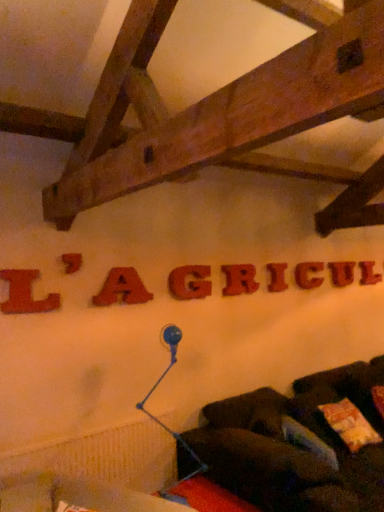
This screenshot has height=512, width=384. What do you see at coordinates (190, 282) in the screenshot?
I see `red matte letter g at center, placed as the 4th letter when sorted from left to right` at bounding box center [190, 282].

You are a GUI agent. You are given a task and a screenshot of the screen. Output one action in this format:
    pyautogui.click(x=<x>, y=<y>)
    Task: Click on the matte red letter at center, acting as the 4th letter starting from the back
    The width and height of the screenshot is (384, 512).
    Given the screenshot: What is the action you would take?
    pyautogui.click(x=277, y=277)

Where is `matte red letter at left, which is the 1th letter from left to right`? Image resolution: width=384 pixels, height=512 pixels. matte red letter at left, which is the 1th letter from left to right is located at coordinates (25, 293).

Where is `dark brown fabric couch at lower right`? This screenshot has height=512, width=384. dark brown fabric couch at lower right is located at coordinates (296, 445).

The height and width of the screenshot is (512, 384). Identify the location of blue glass lamp at lower center. (157, 386).

Describe the element at coordinates (157, 386) in the screenshot. The width and height of the screenshot is (384, 512). I see `blue glass lamp at lower center` at that location.

Describe the element at coordinates (341, 273) in the screenshot. I see `matte red letter at upper center, arranged as the 2th letter when viewed from the back` at that location.

At what (x,y) coordinates should I click in order to perform the action: click on matte red letter at upper center, which is the eighth letter in left-to-right order. Please return your answer as a coordinate pair (x, y). This screenshot has width=384, height=512. Looking at the image, I should click on (341, 273).

Identify the location of red matte letter g at center, the sixth letter viewed from the right. This screenshot has width=384, height=512. (190, 282).

From a real-world perspective, is rubberized red letter r at center, placed as the 5th letter when sorted from left to right, positioned under matte red letter at center, which is the third letter from right to left, based on gravity?

No.

Is rubberized red letter r at center, placed as the fifth letter when sorted from front to back, positioned far away from matte red letter at center, which appears as the 7th letter when viewed from the left?

No, rubberized red letter r at center, placed as the fifth letter when sorted from front to back, is not far away from matte red letter at center, which appears as the 7th letter when viewed from the left.

From the picture: Is rubberized red letter r at center, arranged as the 5th letter when viewed from the right, completely or partially outside of matte red letter at center, which is the 7th letter in front-to-back order?

Yes, rubberized red letter r at center, arranged as the 5th letter when viewed from the right, is outside of matte red letter at center, which is the 7th letter in front-to-back order.

How many degrees apart are the facing directions of rubberized red letter r at center, placed as the 5th letter when sorted from left to right, and matte red letter at center, which is the third letter from right to left?

0.575 degrees separate the facing orientations of rubberized red letter r at center, placed as the 5th letter when sorted from left to right, and matte red letter at center, which is the third letter from right to left.

From a real-world perspective, count 8th letters upward from the matte red letter at center, the 6th letter in the front-to-back sequence, and point to it. Please provide its 2D coordinates.

[(71, 262)]

Is point (273, 287) farther from viewer compared to point (72, 261)?

Yes.

From a real-world perspective, is matte red letter at center, arranged as the 4th letter when viewed from the right, physically below matte red letter at upper center, the 8th letter viewed from the right?

Yes, from a real-world perspective, matte red letter at center, arranged as the 4th letter when viewed from the right, is below matte red letter at upper center, the 8th letter viewed from the right.

From the picture: Is red matte letter g at center, the sixth letter viewed from the right, aimed at matte red letter a at center, which appears as the 7th letter when viewed from the back?

No, red matte letter g at center, the sixth letter viewed from the right, is not aimed at matte red letter a at center, which appears as the 7th letter when viewed from the back.

Which is correct: red matte letter g at center, which ranks as the 4th letter in front-to-back order, is inside matte red letter a at center, which is the 7th letter from right to left, or outside of it?

red matte letter g at center, which ranks as the 4th letter in front-to-back order, is not enclosed by matte red letter a at center, which is the 7th letter from right to left.

Are red matte letter g at center, the sixth letter viewed from the right, and matte red letter a at center, which appears as the 7th letter when viewed from the back, located far from each other?

They are positioned close to each other.

Considering the relative positions of red matte letter g at center, placed as the 4th letter when sorted from left to right, and matte red letter a at center, which appears as the 7th letter when viewed from the back, in the image provided, is red matte letter g at center, placed as the 4th letter when sorted from left to right, behind matte red letter a at center, which appears as the 7th letter when viewed from the back,?

That is True.

From the picture: Which object is thinner, matte red letter at upper center, arranged as the second letter when viewed from the front, or matte red letter at center, acting as the third letter starting from the back?

Thinner between the two is matte red letter at upper center, arranged as the second letter when viewed from the front.

Would you say matte red letter at center, which is the 7th letter in front-to-back order, is part of matte red letter at upper center, the 8th letter viewed from the right,'s contents?

No, matte red letter at center, which is the 7th letter in front-to-back order, is not a part of matte red letter at upper center, the 8th letter viewed from the right.

From a real-world perspective, is matte red letter at upper center, which is counted as the 2th letter, starting from the left, physically above matte red letter at center, acting as the third letter starting from the back?

Indeed, from a real-world perspective, matte red letter at upper center, which is counted as the 2th letter, starting from the left, stands above matte red letter at center, acting as the third letter starting from the back.

In terms of height, does dark brown fabric couch at lower right look taller or shorter compared to red matte letter g at center, which ranks as the 4th letter in front-to-back order?

Clearly, dark brown fabric couch at lower right is taller compared to red matte letter g at center, which ranks as the 4th letter in front-to-back order.

Could you measure the distance between dark brown fabric couch at lower right and red matte letter g at center, which ranks as the 4th letter in front-to-back order?

3.76 feet.

Between point (333, 444) and point (174, 275), which one is positioned behind?

The point (174, 275) is more distant.

Locate an element on the screen. studio couch directly beneath the red matte letter g at center, placed as the 4th letter when sorted from left to right (from a real-world perspective) is located at coordinates (296, 445).

Is point (178, 274) closer or farther from the camera than point (176, 330)?

Clearly, point (178, 274) is more distant from the camera than point (176, 330).

Which object is positioned more to the left, red matte letter g at center, placed as the sixth letter when sorted from back to front, or blue glass lamp at lower center?

blue glass lamp at lower center.

Which of these two, red matte letter g at center, placed as the sixth letter when sorted from back to front, or blue glass lamp at lower center, is wider?

blue glass lamp at lower center is wider.

Image resolution: width=384 pixels, height=512 pixels. Find the location of `lamp that appears below the red matte letter g at center, the sixth letter viewed from the right (from the image's perspective)`. lamp that appears below the red matte letter g at center, the sixth letter viewed from the right (from the image's perspective) is located at coordinates (157, 386).

Which is more to the left, matte red letter at upper center, which is counted as the 2th letter, starting from the right, or red matte letter g at center, the sixth letter viewed from the right?

red matte letter g at center, the sixth letter viewed from the right.

Who is smaller, matte red letter at upper center, which is counted as the 2th letter, starting from the right, or red matte letter g at center, the sixth letter viewed from the right?

matte red letter at upper center, which is counted as the 2th letter, starting from the right, is smaller.

Is matte red letter at upper center, which is the eighth letter in left-to-right order, far away from red matte letter g at center, which ranks as the 4th letter in front-to-back order?

Indeed, matte red letter at upper center, which is the eighth letter in left-to-right order, is not near red matte letter g at center, which ranks as the 4th letter in front-to-back order.

You are a GUI agent. You are given a task and a screenshot of the screen. Output one action in this format:
    pyautogui.click(x=<x>, y=<y>)
    Task: Click on the letter that is the 2nd one when counting backward from the rubberized red letter r at center, placed as the fifth letter when sorted from front to back
    
    Given the screenshot: What is the action you would take?
    coord(309,275)

At what (x,y) coordinates should I click in order to perform the action: click on the 4th letter counting from the right of the matte red letter at upper center, the 8th letter viewed from the right. Please return your answer as a coordinate pair (x, y). This screenshot has width=384, height=512. Looking at the image, I should click on (277, 277).

Estimate the real-world distances between objects in this image. Which object is further from red matte letter g at center, placed as the sixth letter when sorted from back to front, matte red letter at center, acting as the 4th letter starting from the back, or matte red letter at left, which is the 1th letter from left to right?

matte red letter at left, which is the 1th letter from left to right, lies further to red matte letter g at center, placed as the sixth letter when sorted from back to front, than the other object.

From the image, which object appears to be nearer to matte red letter at upper center, which is counted as the 2th letter, starting from the left, blue glass lamp at lower center or rubberized red letter r at center, which ranks as the 5th letter in back-to-front order?

Based on the image, blue glass lamp at lower center appears to be nearer to matte red letter at upper center, which is counted as the 2th letter, starting from the left.

Considering their positions, is matte red sign at center, which appears as the first letter when viewed from the right, positioned further to dark brown fabric couch at lower right than blue glass lamp at lower center?

The object further to dark brown fabric couch at lower right is matte red sign at center, which appears as the first letter when viewed from the right.

Looking at the image, which one is located closer to matte red letter at upper center, acting as the eighth letter starting from the back, matte red sign at center, which appears as the first letter when viewed from the right, or matte red letter at center, which is the third letter from right to left?

matte red letter at center, which is the third letter from right to left, is positioned closer to the anchor matte red letter at upper center, acting as the eighth letter starting from the back.

Based on their spatial positions, is rubberized red letter r at center, placed as the 5th letter when sorted from left to right, or matte red sign at center, which appears as the first letter when viewed from the right, further from dark brown fabric couch at lower right?

Based on the image, matte red sign at center, which appears as the first letter when viewed from the right, appears to be further to dark brown fabric couch at lower right.

Considering their positions, is red matte letter g at center, the sixth letter viewed from the right, positioned closer to matte red letter at upper center, arranged as the second letter when viewed from the front, than matte red sign at center, which ranks as the ninth letter in left-to-right order?

red matte letter g at center, the sixth letter viewed from the right, is positioned closer to the anchor matte red letter at upper center, arranged as the second letter when viewed from the front.

From the image, which object appears to be nearer to matte red sign at center, which ranks as the ninth letter in left-to-right order, blue glass lamp at lower center or matte red letter at center, which is the sixth letter from left to right?

matte red letter at center, which is the sixth letter from left to right, is positioned closer to the anchor matte red sign at center, which ranks as the ninth letter in left-to-right order.

When comparing their distances from matte red letter a at center, which ranks as the third letter in front-to-back order, does dark brown fabric couch at lower right or blue glass lamp at lower center seem further?

Among the two, dark brown fabric couch at lower right is located further to matte red letter a at center, which ranks as the third letter in front-to-back order.

Image resolution: width=384 pixels, height=512 pixels. Find the location of `lamp located between dark brown fabric couch at lower right and rubberized red letter r at center, which ranks as the 5th letter in back-to-front order, in the depth direction`. lamp located between dark brown fabric couch at lower right and rubberized red letter r at center, which ranks as the 5th letter in back-to-front order, in the depth direction is located at coordinates (157, 386).

This screenshot has width=384, height=512. In order to click on letter located between red matte letter g at center, which ranks as the 4th letter in front-to-back order, and matte red letter at center, which is the sixth letter from left to right, in the left-right direction in this screenshot , I will do `click(239, 279)`.

The image size is (384, 512). Find the location of `lamp between matte red letter at upper center, which is counted as the 2th letter, starting from the left, and matte red sign at center, which ranks as the ninth letter in left-to-right order, in the horizontal direction`. lamp between matte red letter at upper center, which is counted as the 2th letter, starting from the left, and matte red sign at center, which ranks as the ninth letter in left-to-right order, in the horizontal direction is located at coordinates (157, 386).

You are a GUI agent. You are given a task and a screenshot of the screen. Output one action in this format:
    pyautogui.click(x=<x>, y=<y>)
    Task: Click on the lamp between matte red letter at left, placed as the 1th letter when sorted from front to back, and matte red letter at center, acting as the third letter starting from the back
    The height and width of the screenshot is (512, 384).
    Given the screenshot: What is the action you would take?
    pyautogui.click(x=157, y=386)